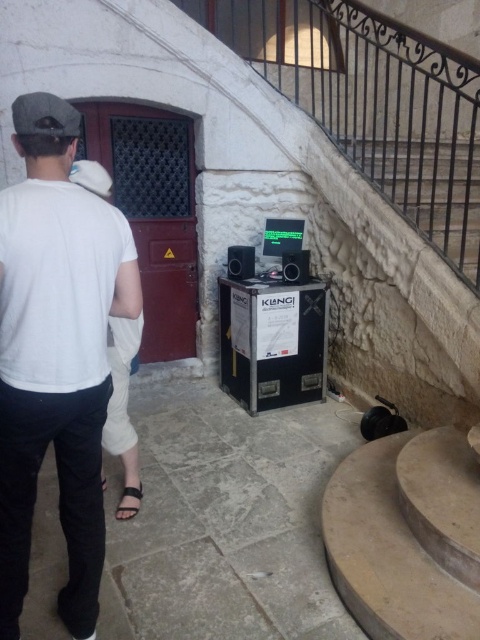
Is point (80, 240) positioned in front of point (128, 513)?

Yes, it is in front of point (128, 513).

Between point (6, 410) and point (126, 488), which one is positioned behind?

Positioned behind is point (126, 488).

The width and height of the screenshot is (480, 640). What are the coordinates of `white cotton shirt at upper left` in the screenshot? It's located at (56, 355).